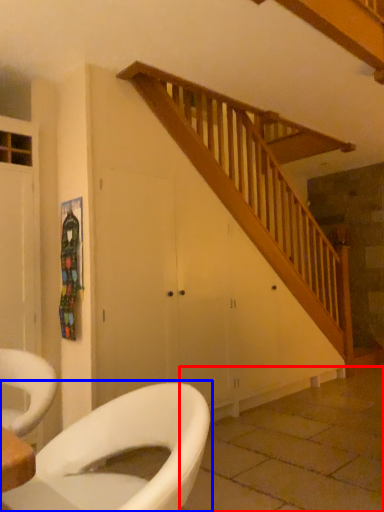
Question: Which object appears farthest to the camera in this image, tile (highlighted by a red box) or toilet (highlighted by a blue box)?

Choices:
 (A) tile
 (B) toilet

Answer: (A)